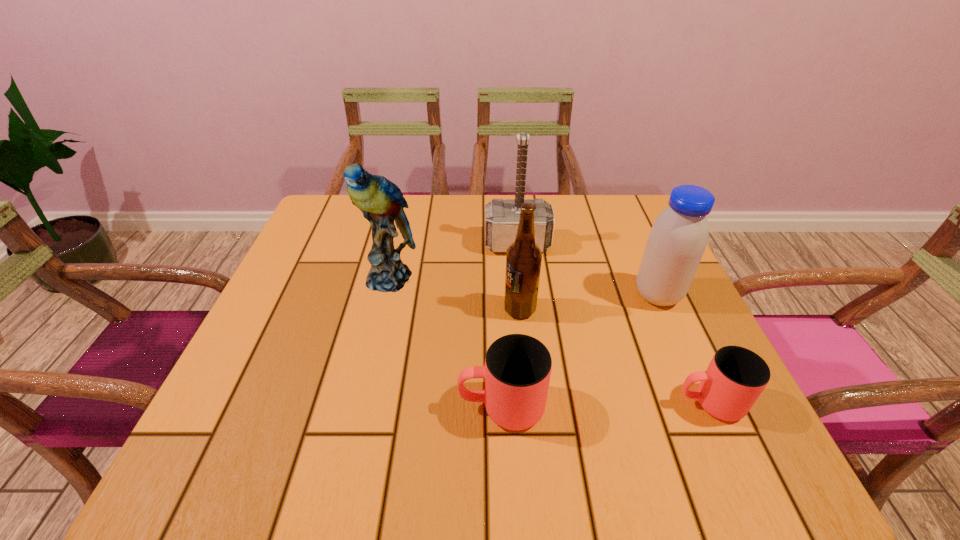
With all cups evenly spaced, where should an extra cup be placed on the left to continue the pattern? Please point out a vacant space. Please provide its 2D coordinates. Your answer should be formatted as a tuple, i.e. [(x, y)], where the tuple contains the x and y coordinates of a point satisfying the conditions above.

[(290, 411)]